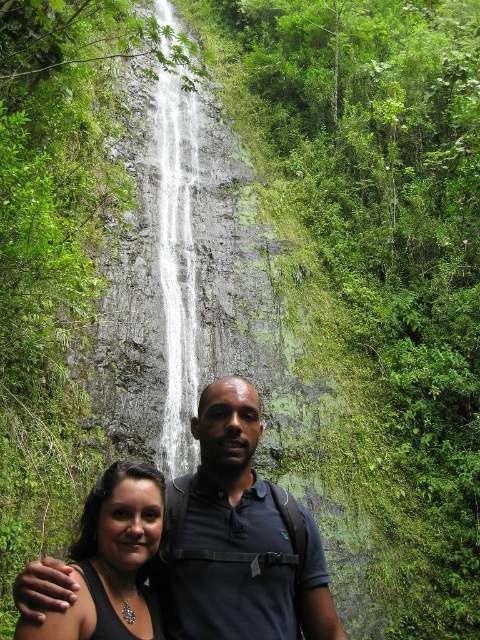
You are a photographer trying to capture a photo of the gray stone waterfall at center while also including the dark blue shirt at center in the frame. Based on their positions, which object should be placed on the left side of the camera frame to ensure both are visible?

The gray stone waterfall at center should be placed on the left side of the camera frame because the dark blue shirt at center is positioned on the right side of it, allowing both to be included in the frame.

You are a photographer trying to capture a photo of the dark blue shirt at center and the shiny silver necklace at lower left in the same frame. The camera you are using has a maximum focus range of 6 meters. Will you be able to include both objects in the photo without moving closer?

The distance between the dark blue shirt at center and the shiny silver necklace at lower left is 6.50 meters. Since the camera can only focus up to 6 meters, you won cannot capture both objects in the same frame without moving closer.

You are a photographer trying to capture both the dark blue shirt at center and the shiny silver necklace at lower left in a single frame. Based on their positions, which object should you adjust your camera to focus on first to ensure both are in the shot?

Since the dark blue shirt at center is to the right of the shiny silver necklace at lower left, you should focus on the shiny silver necklace at lower left first, as it is positioned further left and closer to the edge of the frame. This ensures both objects remain within the camera view when adjusting.